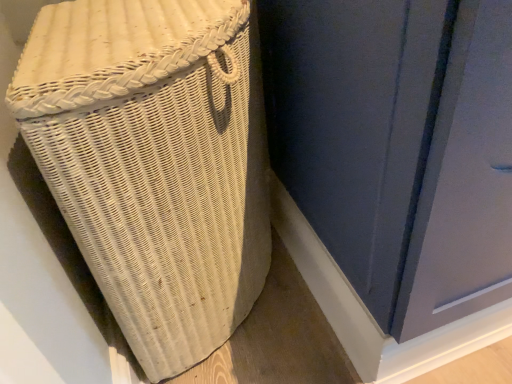
Question: From the image's perspective, is matte blue screen door at center located above or below white wicker basket at left?

Choices:
 (A) below
 (B) above

Answer: (B)

Question: Choose the correct answer: Is matte blue screen door at center inside white wicker basket at left or outside it?

Choices:
 (A) inside
 (B) outside

Answer: (B)

Question: Is matte blue screen door at center to the left or to the right of white wicker basket at left in the image?

Choices:
 (A) left
 (B) right

Answer: (B)

Question: Looking at their shapes, would you say white wicker basket at left is wider or thinner than matte blue screen door at center?

Choices:
 (A) thin
 (B) wide

Answer: (A)

Question: From a real-world perspective, is white wicker basket at left physically located above or below matte blue screen door at center?

Choices:
 (A) below
 (B) above

Answer: (A)

Question: Do you think white wicker basket at left is within matte blue screen door at center, or outside of it?

Choices:
 (A) outside
 (B) inside

Answer: (A)

Question: Visually, is white wicker basket at left positioned to the left or to the right of matte blue screen door at center?

Choices:
 (A) left
 (B) right

Answer: (A)